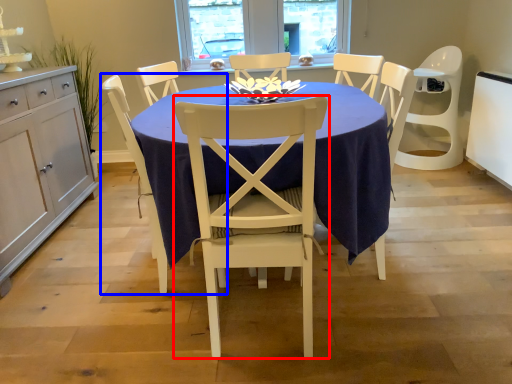
Question: Which of the following is the farthest to the observer, chair (highlighted by a red box) or chair (highlighted by a blue box)?

Choices:
 (A) chair
 (B) chair

Answer: (B)